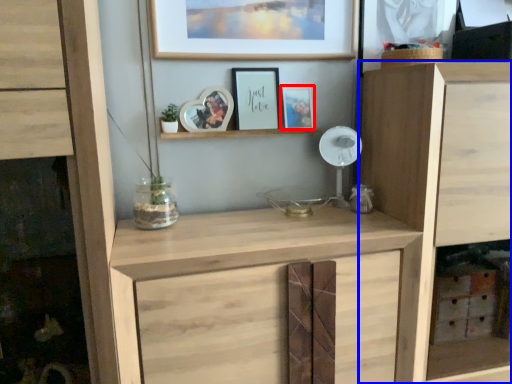
Question: Which object is closer to the camera taking this photo, picture frame (highlighted by a red box) or cupboard (highlighted by a blue box)?

Choices:
 (A) picture frame
 (B) cupboard

Answer: (B)